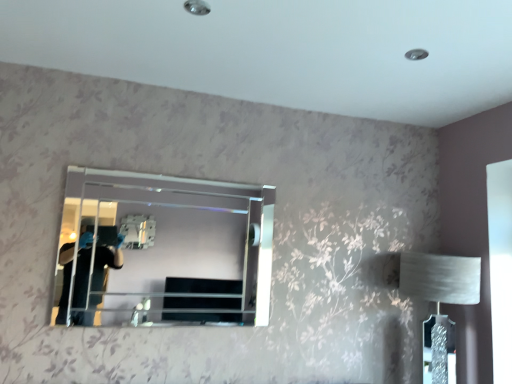
Question: Relative to clear glass mirror at center, is white fabric lampshade at right in front or behind?

Choices:
 (A) front
 (B) behind

Answer: (B)

Question: Considering the positions of white fabric lampshade at right and clear glass mirror at center in the image, is white fabric lampshade at right taller or shorter than clear glass mirror at center?

Choices:
 (A) tall
 (B) short

Answer: (A)

Question: Do you think white fabric lampshade at right is within clear glass mirror at center, or outside of it?

Choices:
 (A) outside
 (B) inside

Answer: (A)

Question: Is point (87, 301) closer or farther from the camera than point (450, 296)?

Choices:
 (A) farther
 (B) closer

Answer: (A)

Question: In the image, is clear glass mirror at center positioned in front of or behind white fabric lampshade at right?

Choices:
 (A) behind
 (B) front

Answer: (B)

Question: Is clear glass mirror at center inside the boundaries of white fabric lampshade at right, or outside?

Choices:
 (A) outside
 (B) inside

Answer: (A)

Question: From a real-world perspective, is clear glass mirror at center physically located above or below white fabric lampshade at right?

Choices:
 (A) below
 (B) above

Answer: (B)